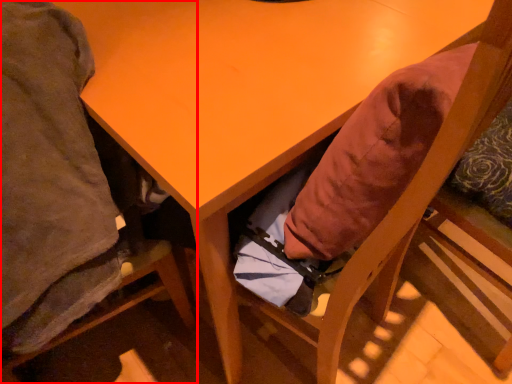
Question: In this image, where is chair (annotated by the red box) located relative to chair?

Choices:
 (A) left
 (B) right

Answer: (A)